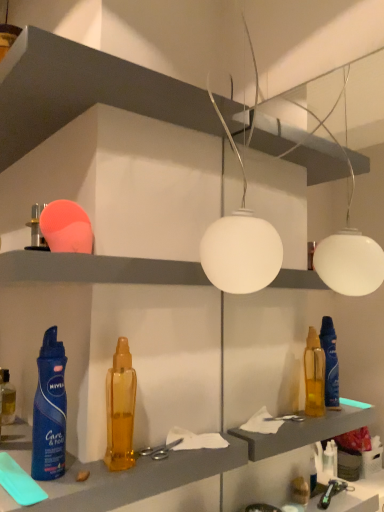
Where is `free space that is in between blue matte spray can at lower left, which is the 1th bottle from front to back, and silver metallic scissors at center`? The image size is (384, 512). free space that is in between blue matte spray can at lower left, which is the 1th bottle from front to back, and silver metallic scissors at center is located at coordinates (107, 462).